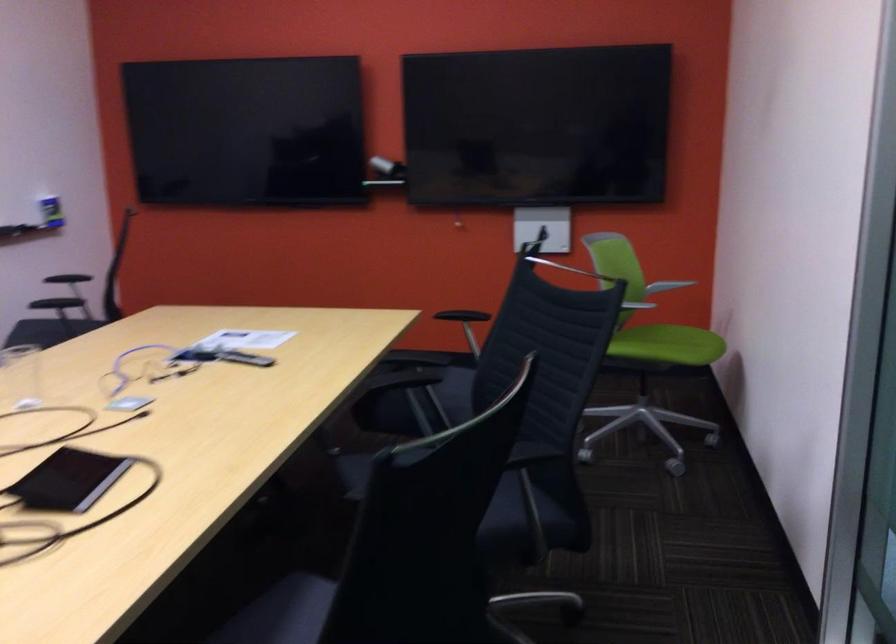
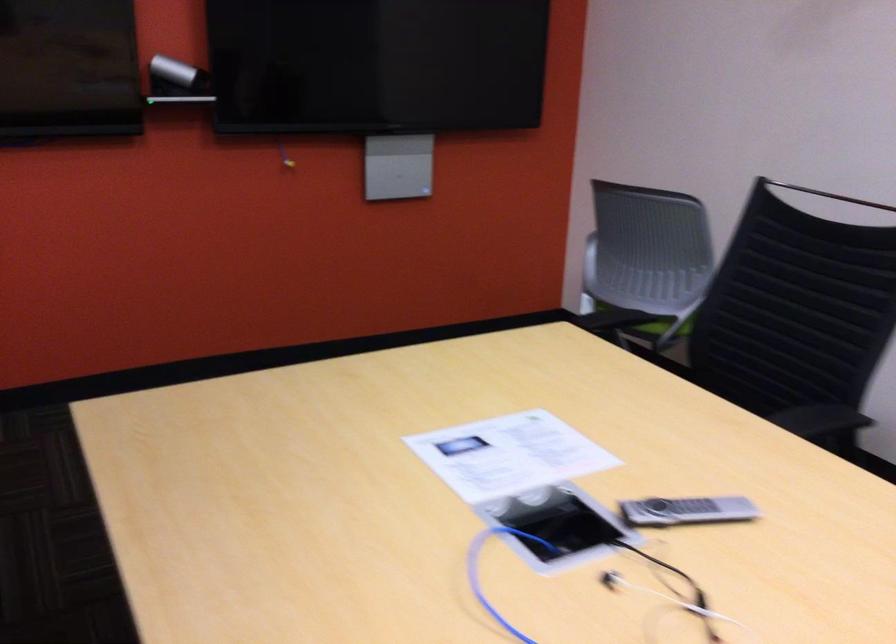
In the second image, find the point that corresponds to point (178, 366) in the first image.

(576, 583)